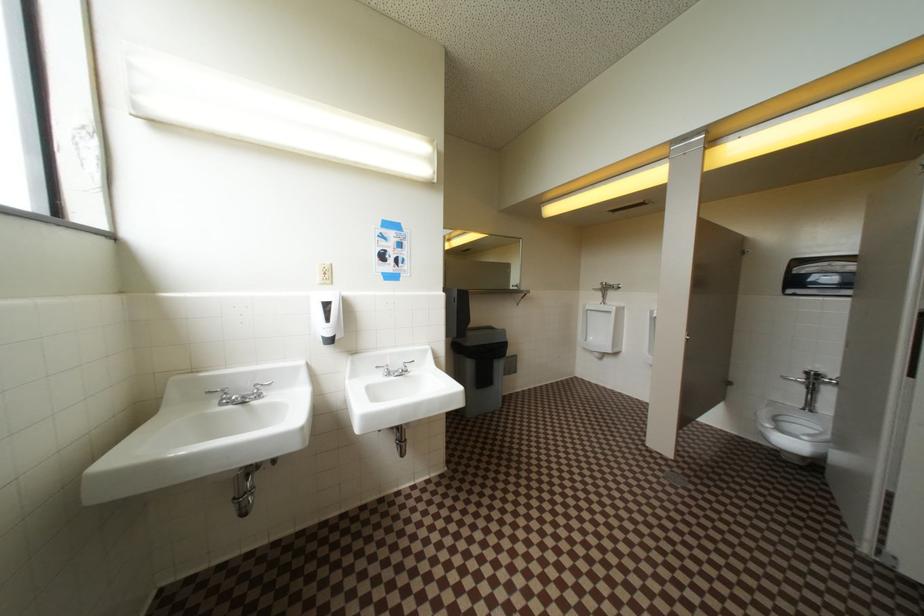
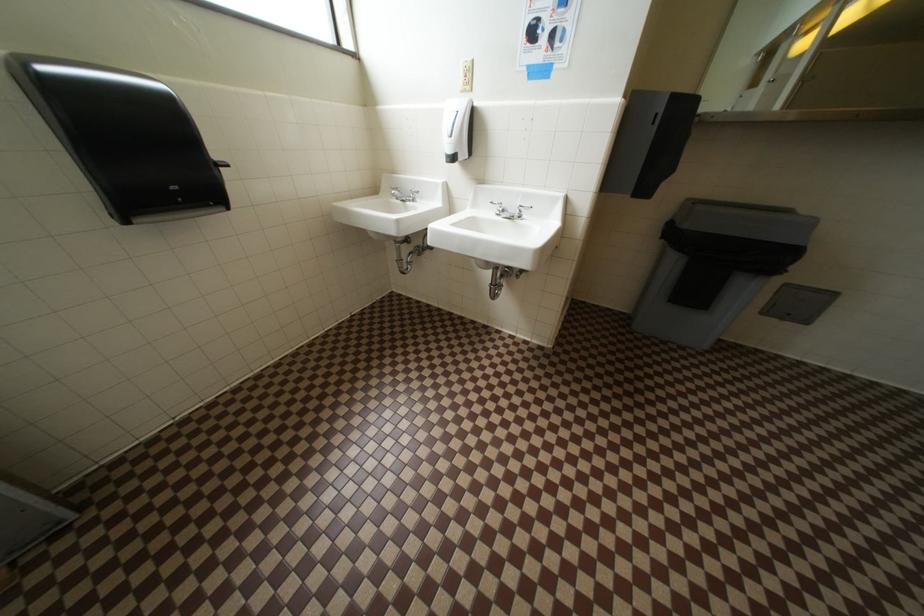
How did the camera likely rotate?

The rotation direction of the camera is left-down.